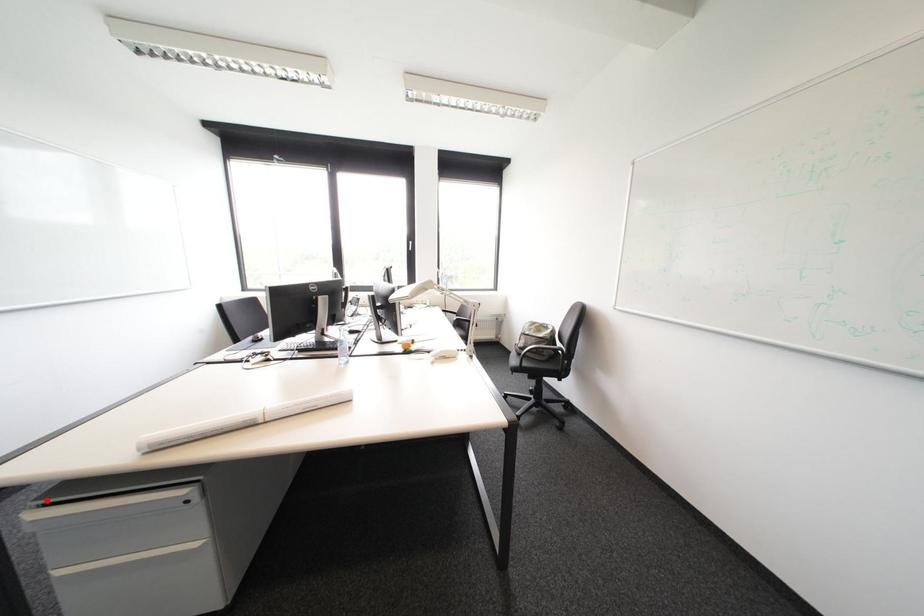
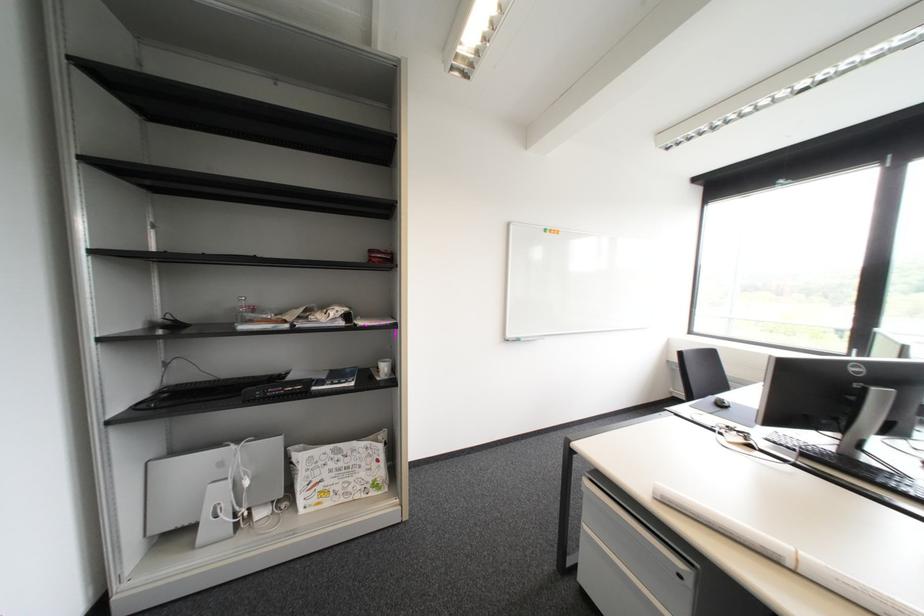
The point at the highlighted location is marked in the first image. Where is the corresponding point in the second image?

(600, 474)